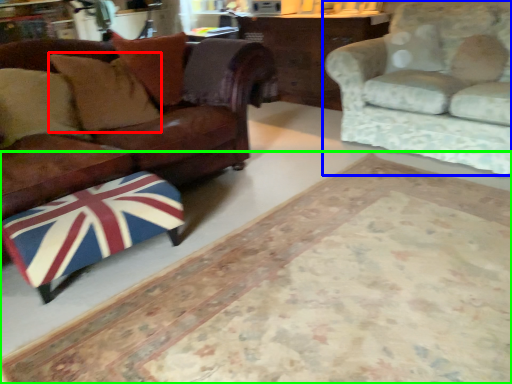
Question: Considering the real-world distances, which object is farthest from pillow (highlighted by a red box)? studio couch (highlighted by a blue box) or mat (highlighted by a green box)?

Choices:
 (A) studio couch
 (B) mat

Answer: (A)